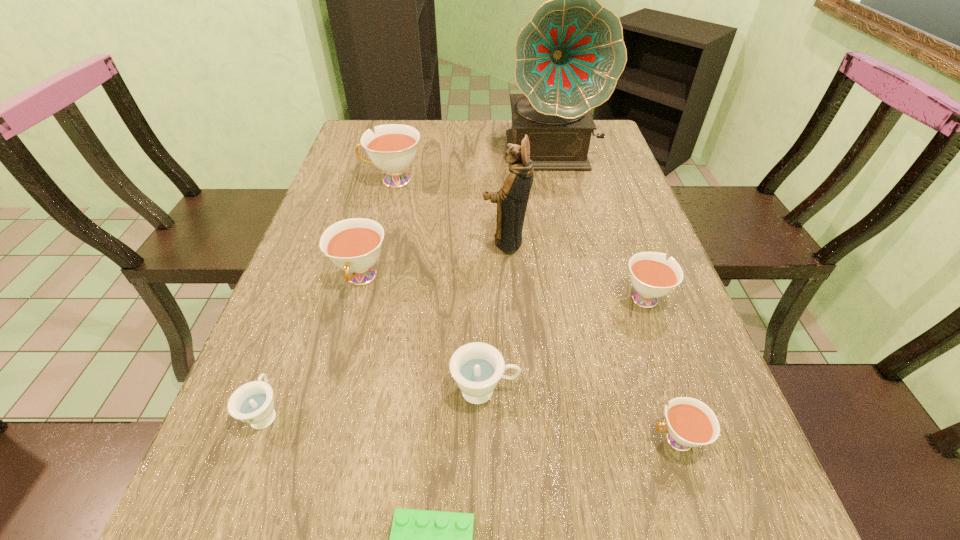
In order to click on the tallest object in this screenshot , I will do `click(569, 56)`.

The height and width of the screenshot is (540, 960). Find the location of `figurine`. figurine is located at coordinates (512, 198).

You are a GUI agent. You are given a task and a screenshot of the screen. Output one action in this format:
    pyautogui.click(x=<x>, y=<y>)
    Task: Click on the biggest white teacup
    
    Given the screenshot: What is the action you would take?
    pyautogui.click(x=392, y=149)

Where is `the farthest white teacup`? Image resolution: width=960 pixels, height=540 pixels. the farthest white teacup is located at coordinates (392, 149).

You are a GUI agent. You are given a task and a screenshot of the screen. Output one action in this format:
    pyautogui.click(x=<x>, y=<y>)
    Task: Click on the third smallest white teacup
    This screenshot has width=960, height=540.
    Given the screenshot: What is the action you would take?
    pyautogui.click(x=354, y=245)

At what (x,y) coordinates should I click in order to perform the action: click on the sixth shortest object. Please return your answer as a coordinate pair (x, y). The width and height of the screenshot is (960, 540). Looking at the image, I should click on (354, 245).

You are a GUI agent. You are given a task and a screenshot of the screen. Output one action in this format:
    pyautogui.click(x=<x>, y=<y>)
    Task: Click on the second smallest white teacup
    
    Given the screenshot: What is the action you would take?
    pyautogui.click(x=652, y=276)

Find the location of a particular element. the right blue teacup is located at coordinates (476, 367).

Identify the location of the third teacup from right to left. Image resolution: width=960 pixels, height=540 pixels. (476, 367).

Where is `the smallest white teacup`? This screenshot has height=540, width=960. the smallest white teacup is located at coordinates (691, 423).